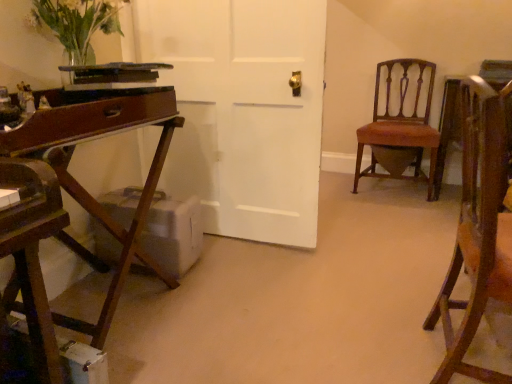
Question: Would you say translucent glass vase at upper left is a long distance from wooden chair at right, which is the second chair from back to front?

Choices:
 (A) no
 (B) yes

Answer: (B)

Question: Is translucent glass vase at upper left oriented away from wooden chair at right, which is the second chair from back to front?

Choices:
 (A) yes
 (B) no

Answer: (B)

Question: Is translucent glass vase at upper left facing towards wooden chair at right, which is the second chair from back to front?

Choices:
 (A) no
 (B) yes

Answer: (A)

Question: Is translucent glass vase at upper left in front of wooden chair at right, positioned as the 1th chair in front-to-back order?

Choices:
 (A) yes
 (B) no

Answer: (B)

Question: From a real-world perspective, is translucent glass vase at upper left beneath wooden chair at right, positioned as the 1th chair in front-to-back order?

Choices:
 (A) yes
 (B) no

Answer: (B)

Question: From their relative heights in the image, would you say wooden chair at right, positioned as the 1th chair in front-to-back order, is taller or shorter than translucent glass vase at upper left?

Choices:
 (A) tall
 (B) short

Answer: (A)

Question: Is wooden chair at right, which is the second chair from back to front, inside or outside of translucent glass vase at upper left?

Choices:
 (A) outside
 (B) inside

Answer: (A)

Question: Would you say wooden chair at right, positioned as the 1th chair in front-to-back order, is to the left or to the right of translucent glass vase at upper left in the picture?

Choices:
 (A) right
 (B) left

Answer: (A)

Question: From a real-world perspective, is wooden chair at right, which is the second chair from back to front, physically located above or below translucent glass vase at upper left?

Choices:
 (A) above
 (B) below

Answer: (B)

Question: Is point (412, 109) positioned closer to the camera than point (485, 203)?

Choices:
 (A) farther
 (B) closer

Answer: (A)

Question: Considering the positions of mahogany wood chair at right, which is the 1th chair from back to front, and wooden chair at right, which is the second chair from back to front, in the image, is mahogany wood chair at right, which is the 1th chair from back to front, wider or thinner than wooden chair at right, which is the second chair from back to front,?

Choices:
 (A) thin
 (B) wide

Answer: (B)

Question: Relative to wooden chair at right, positioned as the 1th chair in front-to-back order, is mahogany wood chair at right, which is the 1th chair from back to front, in front or behind?

Choices:
 (A) front
 (B) behind

Answer: (B)

Question: From the image's perspective, relative to wooden chair at right, positioned as the 1th chair in front-to-back order, is mahogany wood chair at right, the 2th chair positioned from the front, above or below?

Choices:
 (A) above
 (B) below

Answer: (A)

Question: Would you say translucent glass vase at upper left is to the left or to the right of wooden chair at right, which is the second chair from back to front, in the picture?

Choices:
 (A) left
 (B) right

Answer: (A)

Question: From a real-world perspective, relative to wooden chair at right, which is the second chair from back to front, is translucent glass vase at upper left vertically above or below?

Choices:
 (A) below
 (B) above

Answer: (B)